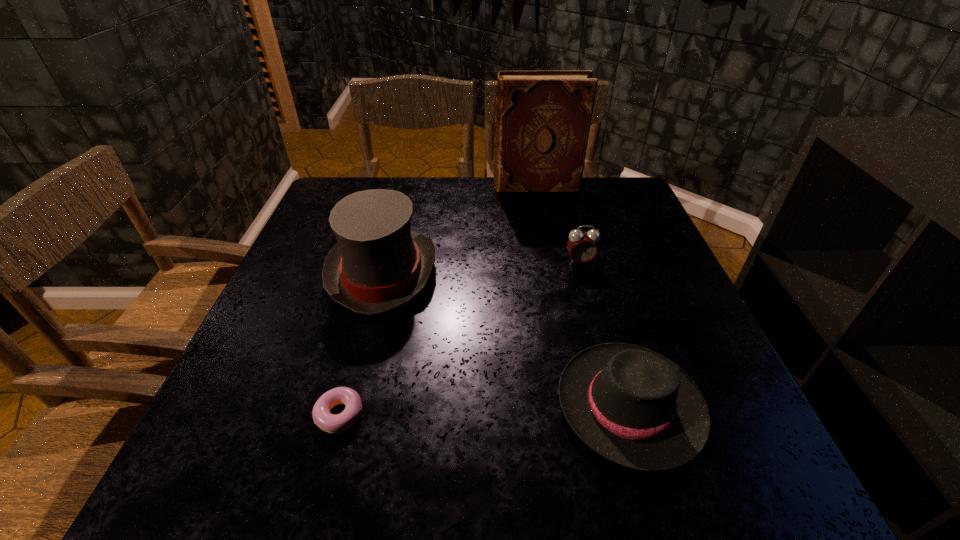
Find the location of a particular element. The height and width of the screenshot is (540, 960). free region that satisfies the following two spatial constraints: 1. on the spine side of the farthest object; 2. on the front side of the second tallest object is located at coordinates (552, 273).

The image size is (960, 540). In order to click on vacant region that satisfies the following two spatial constraints: 1. on the spine side of the tallest object; 2. on the front side of the taller dress hat in this screenshot , I will do `click(552, 273)`.

Locate an element on the screen. The image size is (960, 540). vacant region that satisfies the following two spatial constraints: 1. on the spine side of the hardback book; 2. on the back side of the right dress hat is located at coordinates (577, 406).

Image resolution: width=960 pixels, height=540 pixels. Find the location of `free location that satisfies the following two spatial constraints: 1. on the clock face of the shorter dress hat; 2. on the left side of the alarm clock`. free location that satisfies the following two spatial constraints: 1. on the clock face of the shorter dress hat; 2. on the left side of the alarm clock is located at coordinates (619, 406).